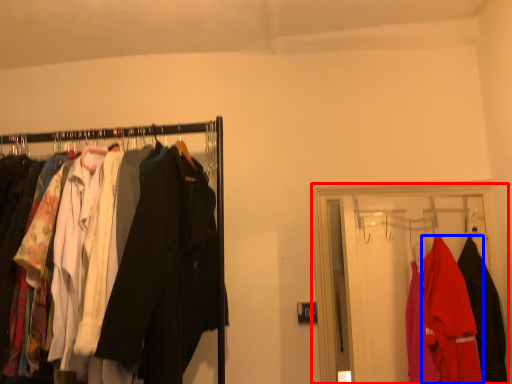
Question: Which of the following is the closest to the observer, closet (highlighted by a red box) or fancy dress (highlighted by a blue box)?

Choices:
 (A) closet
 (B) fancy dress

Answer: (B)